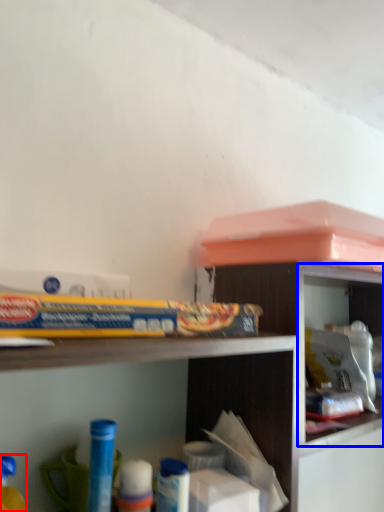
Question: Among these objects, which one is farthest to the camera, toy (highlighted by a red box) or cabinet (highlighted by a blue box)?

Choices:
 (A) toy
 (B) cabinet

Answer: (B)